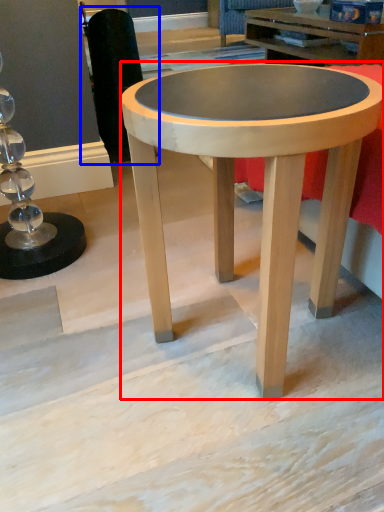
Question: Which object is further to the camera taking this photo, coffee table (highlighted by a red box) or swivel chair (highlighted by a blue box)?

Choices:
 (A) coffee table
 (B) swivel chair

Answer: (B)